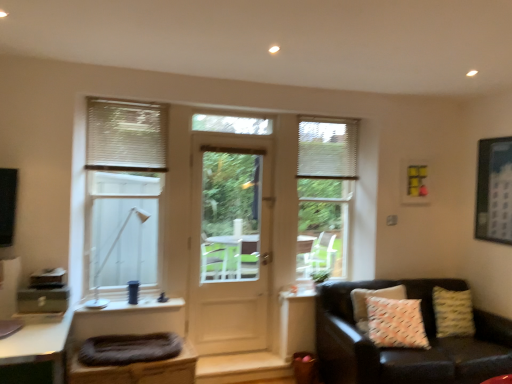
Identify the location of free spot above white wooden door at center (from a real-world perspective). Image resolution: width=512 pixels, height=384 pixels. (233, 140).